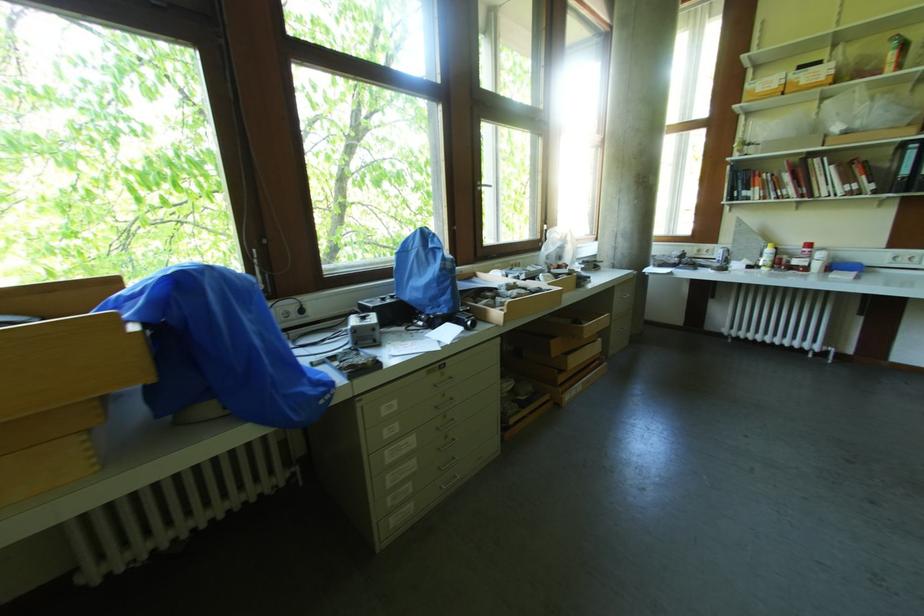
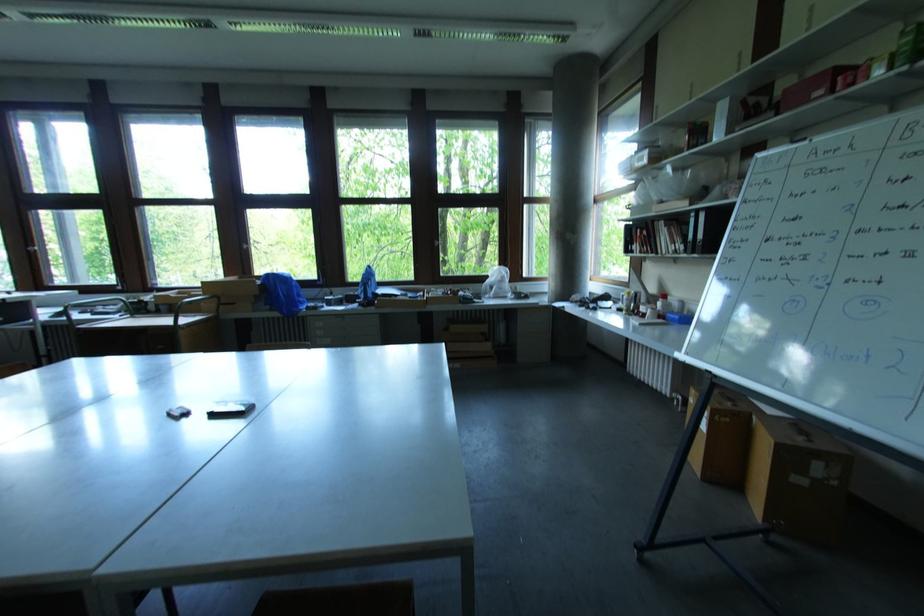
The point at (811, 246) is marked in the first image. Where is the corresponding point in the second image?

(667, 298)